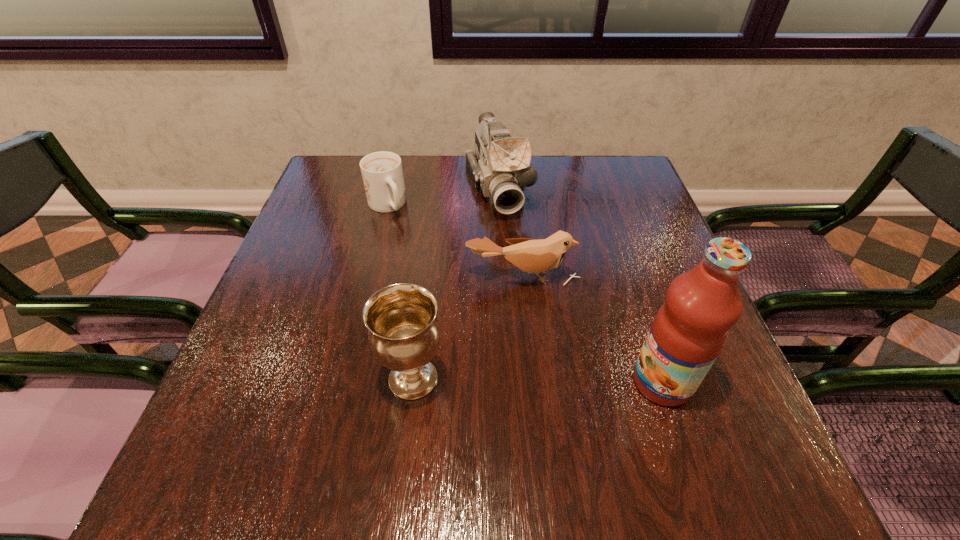
In order to click on camcorder that is at the far edge in this screenshot , I will do `click(500, 168)`.

Where is `chalice that is positioned at the near edge`? This screenshot has height=540, width=960. chalice that is positioned at the near edge is located at coordinates (404, 333).

You are a GUI agent. You are given a task and a screenshot of the screen. Output one action in this format:
    pyautogui.click(x=<x>, y=<y>)
    Task: Click on the fruit juice that is positioned at the near edge
    This screenshot has height=540, width=960.
    Given the screenshot: What is the action you would take?
    pyautogui.click(x=690, y=329)

This screenshot has height=540, width=960. I want to click on object at the left edge, so click(382, 173).

At what (x,y) coordinates should I click in order to perform the action: click on object that is at the right edge. Please return your answer as a coordinate pair (x, y). Image resolution: width=960 pixels, height=540 pixels. Looking at the image, I should click on (690, 329).

At what (x,y) coordinates should I click in order to perform the action: click on object at the far left corner. Please return your answer as a coordinate pair (x, y). The height and width of the screenshot is (540, 960). Looking at the image, I should click on (382, 173).

This screenshot has height=540, width=960. What are the coordinates of `object that is at the near right corner` in the screenshot? It's located at (690, 329).

You are a GUI agent. You are given a task and a screenshot of the screen. Output one action in this format:
    pyautogui.click(x=<x>, y=<y>)
    Task: Click on the free space at the far edge
    
    Given the screenshot: What is the action you would take?
    pyautogui.click(x=431, y=174)

Where is `vacant region at the near edge of the desktop`? This screenshot has height=540, width=960. vacant region at the near edge of the desktop is located at coordinates (507, 403).

Identify the location of vacant region at the left edge. (343, 227).